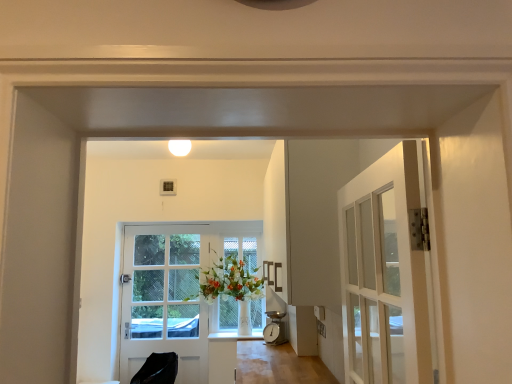
Question: Considering the positions of white glossy door at center and white matte light fixture at upper center in the image, is white glossy door at center taller or shorter than white matte light fixture at upper center?

Choices:
 (A) tall
 (B) short

Answer: (A)

Question: From a real-world perspective, is white glossy door at center above or below white matte light fixture at upper center?

Choices:
 (A) below
 (B) above

Answer: (A)

Question: Estimate the real-world distances between objects in this image. Which object is closer to the clear glass window at center?

Choices:
 (A) white matte light fixture at upper center
 (B) white glossy door at center
 (C) black leather chair at lower left

Answer: (B)

Question: Which is nearer to the black leather chair at lower left?

Choices:
 (A) white matte light fixture at upper center
 (B) white glossy door at center
 (C) clear glass window at center

Answer: (B)